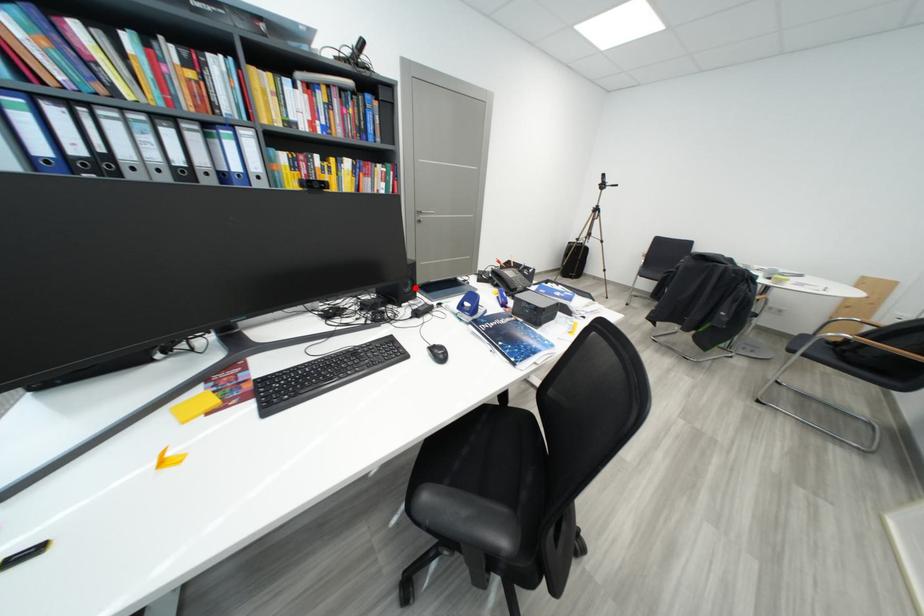
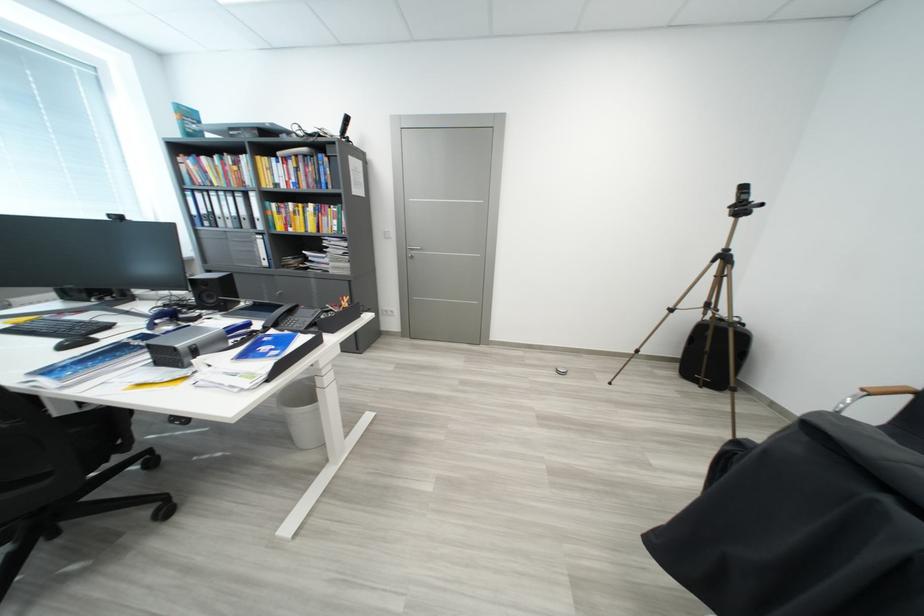
Locate, in the second image, the point that corresponds to the highlighted location in the first image.

(220, 300)